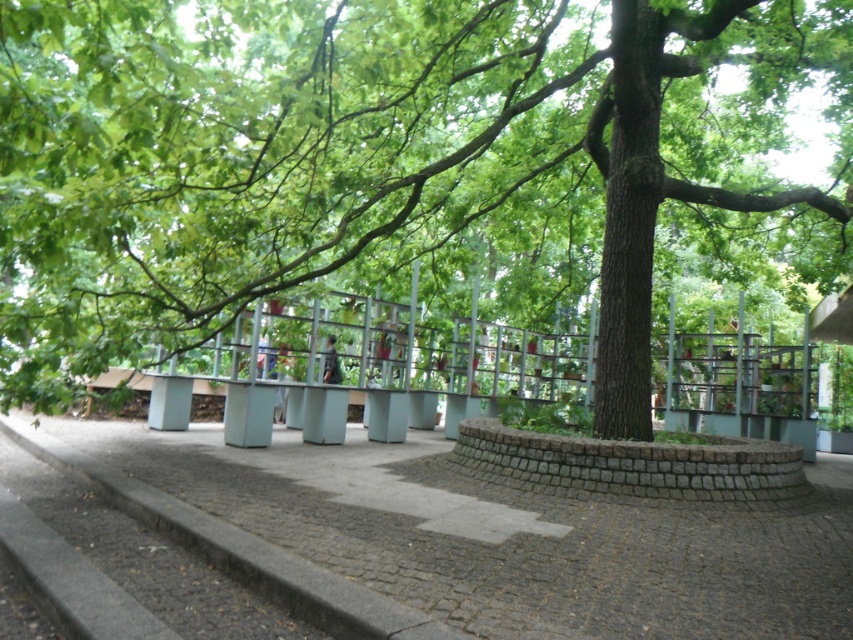
Question: Can you confirm if green leafy tree at center is positioned to the left of gray cobblestone pavement at center?

Choices:
 (A) yes
 (B) no

Answer: (B)

Question: Among these points, which one is farthest from the camera?

Choices:
 (A) (421, 534)
 (B) (90, 310)

Answer: (B)

Question: Is green leafy tree at center bigger than gray cobblestone pavement at center?

Choices:
 (A) yes
 (B) no

Answer: (A)

Question: Which point is closer to the camera taking this photo?

Choices:
 (A) (502, 140)
 (B) (321, 548)

Answer: (B)

Question: Can you confirm if green leafy tree at center is positioned below gray cobblestone pavement at center?

Choices:
 (A) no
 (B) yes

Answer: (A)